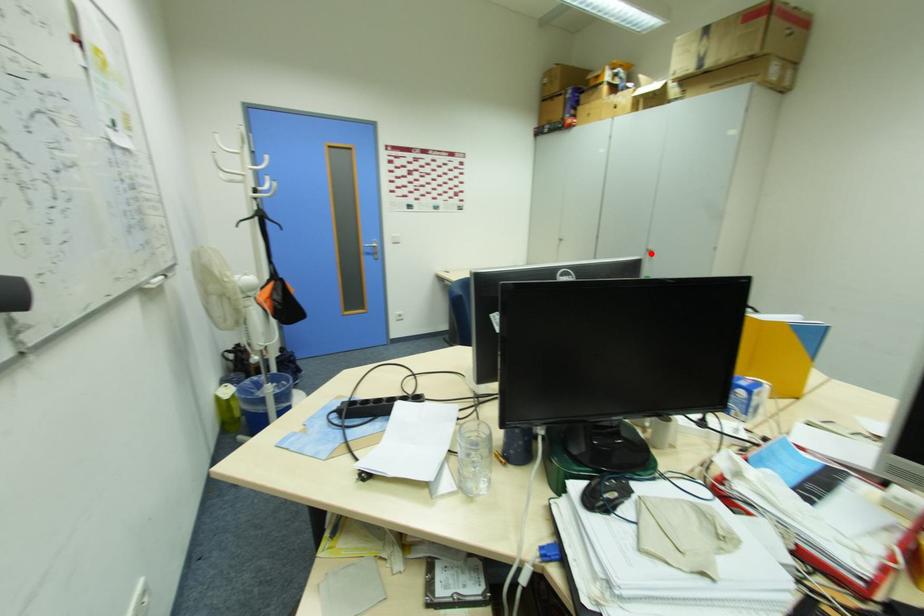
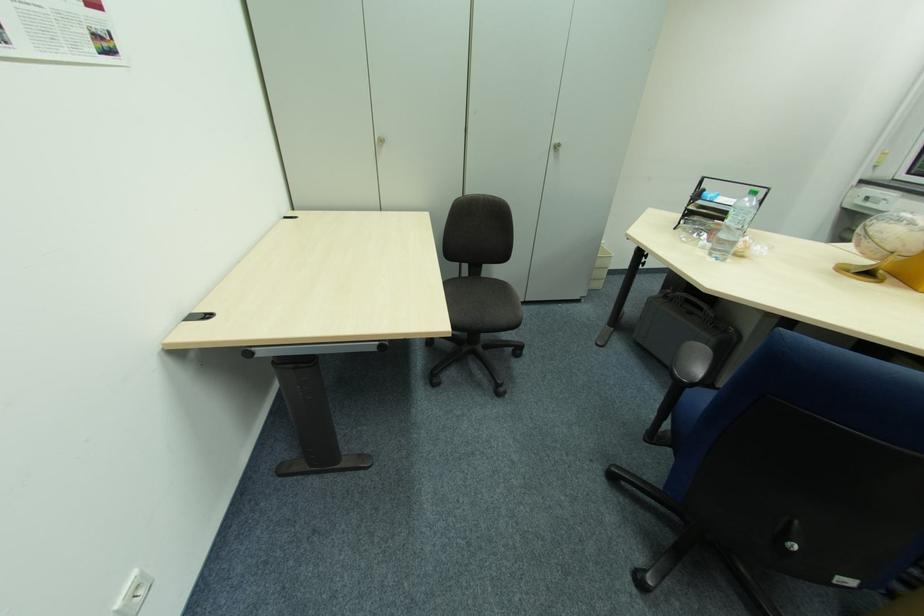
Where in the second image is the point corresponding to the highlighted location from the first image?

(554, 150)